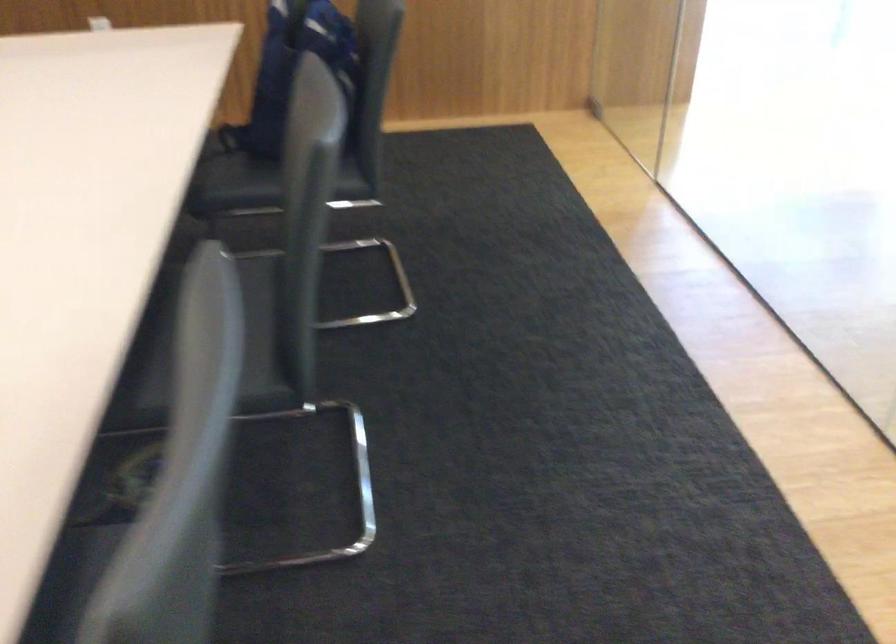
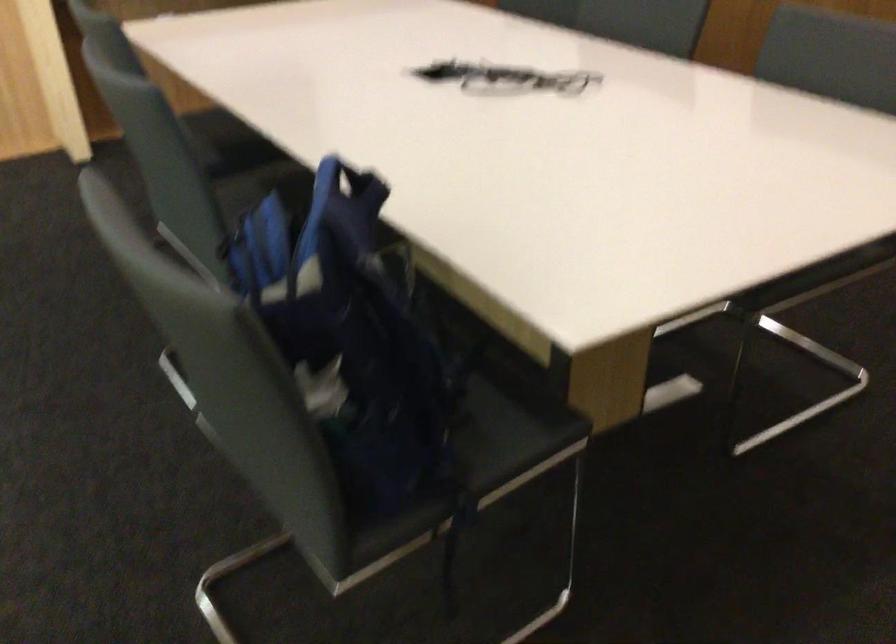
Where in the second image is the point corresponding to (x=254, y=140) from the first image?

(484, 451)